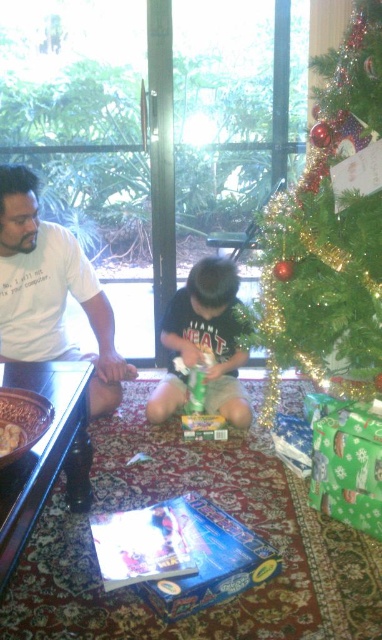
Question: Is green shiny tree at right smaller than white t-shirt at left?

Choices:
 (A) no
 (B) yes

Answer: (A)

Question: Which point is closer to the camera?

Choices:
 (A) (184, 296)
 (B) (352, 320)
 (C) (14, 189)
 (D) (98, 36)

Answer: (B)

Question: Considering the relative positions of green shiny christmas tree at upper right and dark green jersey at center in the image provided, where is green shiny christmas tree at upper right located with respect to dark green jersey at center?

Choices:
 (A) below
 (B) above

Answer: (B)

Question: Which point is closer to the camera taking this photo?

Choices:
 (A) (30, 204)
 (B) (148, 416)
 (C) (255, 129)

Answer: (A)

Question: Is green shiny christmas tree at upper right thinner than green shiny tree at right?

Choices:
 (A) yes
 (B) no

Answer: (B)

Question: Which point is closer to the camera taking this photo?

Choices:
 (A) (357, 342)
 (B) (200, 72)
 (C) (85, 284)
 (D) (176, 387)

Answer: (A)